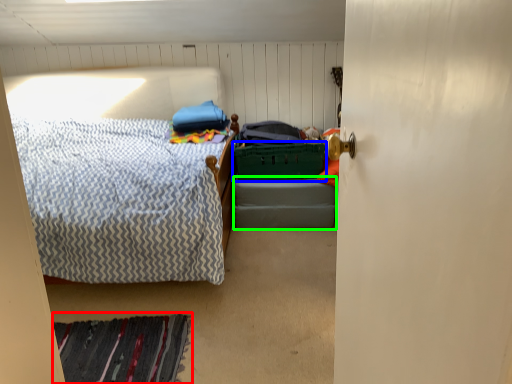
Question: Which object is the closest to the mat (highlighted by a red box)? Choose among these: laundry basket (highlighted by a blue box) or bed frame (highlighted by a green box).

Choices:
 (A) laundry basket
 (B) bed frame

Answer: (B)